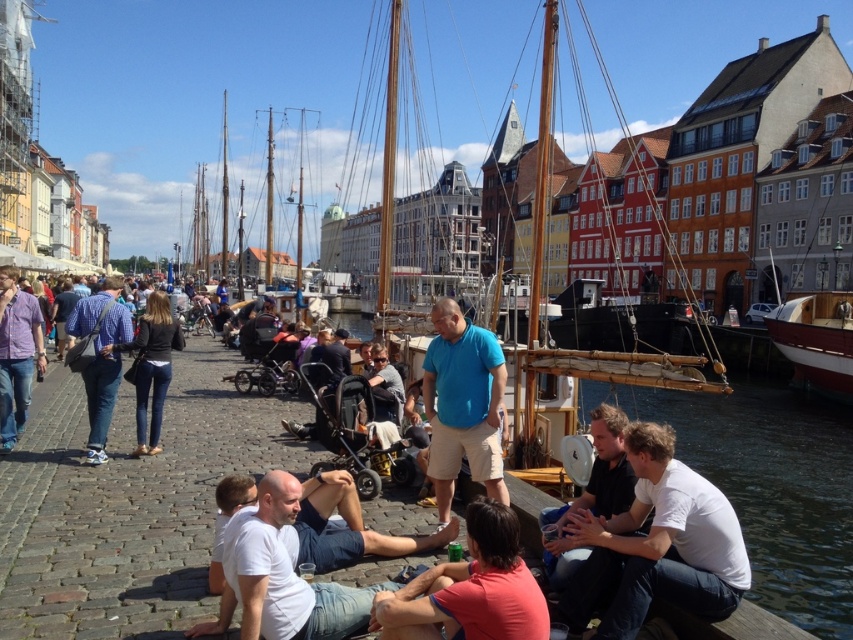
You are a photographer standing at the waterfront, aiming to capture a photo of both the white cotton shirt at lower right and the red shirt at lower center. Which shirt should you adjust your camera to focus on first if you want to include both in the frame without moving your position?

You should focus on the red shirt at lower center first because the white cotton shirt at lower right is to the right of it, so adjusting the camera to include both would require framing from the center outward.

You are standing at the point labeled point (122, 339) and want to walk to the point labeled point (403, 401). Which direction should you move to get closer to your destination?

To move from point (122, 339) to point (403, 401), you should move upwards and to the right since point (403, 401) is further away from the camera compared to point (122, 339).